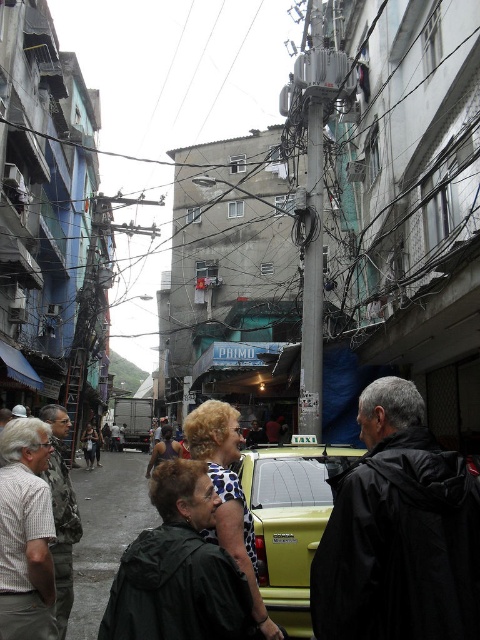
You are a pedestrian standing at the edge of the street. You see a dark green jacket at center and a green matte taxi at center. If you want to cross the street to reach the taxi, will you have enough space to walk between them?

The distance between the dark green jacket at center and the green matte taxi at center is 8.43 feet, so yes, there is enough space to walk between them since 8.43 feet is more than sufficient for a pedestrian to pass comfortably.

You are standing at the point marked by the coordinates point (398, 532) in the image. What object is located at those coordinates?

The point (398, 532) indicates the location of the black matte jacket at lower right.

You are a tourist in this city and want to take the green matte taxi at center to the airport. However, you notice a dark green jacket at center in your way. Is the jacket blocking your path to the taxi?

The dark green jacket at center is to the left of the green matte taxi at center, so it is not blocking the path directly in front of the taxi. You can walk around it to reach the taxi.